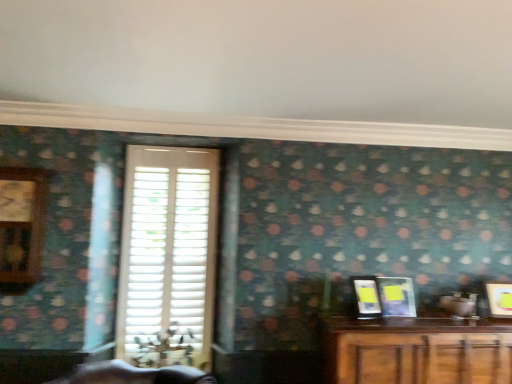
At what (x,y) coordinates should I click in order to perform the action: click on matte black picture frame at right, which is counted as the 3th picture frame, starting from the right. Please return your answer as a coordinate pair (x, y). The width and height of the screenshot is (512, 384). Looking at the image, I should click on (366, 297).

What do you see at coordinates (366, 297) in the screenshot?
I see `matte black picture frame at right, arranged as the first picture frame when viewed from the left` at bounding box center [366, 297].

Find the location of a particular element. This screenshot has width=512, height=384. wooden clock at left is located at coordinates (22, 223).

Find the location of a particular element. The height and width of the screenshot is (384, 512). matte yellow picture frame at right, which ranks as the 3th picture frame in left-to-right order is located at coordinates (499, 299).

The image size is (512, 384). What do you see at coordinates (168, 256) in the screenshot?
I see `white matte shutters at center` at bounding box center [168, 256].

You are a GUI agent. You are given a task and a screenshot of the screen. Output one action in this format:
    pyautogui.click(x=<x>, y=<y>)
    Task: Click on the matte black picture frame at right, which is counted as the 3th picture frame, starting from the right
    
    Given the screenshot: What is the action you would take?
    pyautogui.click(x=366, y=297)

From the image's perspective, relative to metallic silver picture frame at right, which is counted as the second picture frame, starting from the right, is matte black picture frame at right, which is counted as the 3th picture frame, starting from the right, above or below?

matte black picture frame at right, which is counted as the 3th picture frame, starting from the right, is above metallic silver picture frame at right, which is counted as the second picture frame, starting from the right.

Based on the photo, does matte black picture frame at right, which is counted as the 3th picture frame, starting from the right, have a greater width compared to metallic silver picture frame at right, which is counted as the second picture frame, starting from the right?

No, matte black picture frame at right, which is counted as the 3th picture frame, starting from the right, is not wider than metallic silver picture frame at right, which is counted as the second picture frame, starting from the right.

Looking at the image, does matte black picture frame at right, arranged as the first picture frame when viewed from the left, seem bigger or smaller compared to metallic silver picture frame at right, the second picture frame in the left-to-right sequence?

Considering their sizes, matte black picture frame at right, arranged as the first picture frame when viewed from the left, takes up less space than metallic silver picture frame at right, the second picture frame in the left-to-right sequence.

Considering the positions of point (376, 317) and point (392, 280), is point (376, 317) closer or farther from the camera than point (392, 280)?

Point (376, 317) appears to be closer to the viewer than point (392, 280).

Is white matte shutters at center wider than matte yellow picture frame at right, which ranks as the 3th picture frame in left-to-right order?

Incorrect, the width of white matte shutters at center does not surpass that of matte yellow picture frame at right, which ranks as the 3th picture frame in left-to-right order.

Is white matte shutters at center facing towards matte yellow picture frame at right, which ranks as the 3th picture frame in left-to-right order?

No.

Are white matte shutters at center and matte yellow picture frame at right, which ranks as the 3th picture frame in left-to-right order, far apart?

Yes, white matte shutters at center is far from matte yellow picture frame at right, which ranks as the 3th picture frame in left-to-right order.

Can we say white matte shutters at center lies outside matte yellow picture frame at right, marked as the 1th picture frame in a right-to-left arrangement?

That's correct, white matte shutters at center is outside of matte yellow picture frame at right, marked as the 1th picture frame in a right-to-left arrangement.

Could you measure the distance between matte yellow picture frame at right, marked as the 1th picture frame in a right-to-left arrangement, and matte black picture frame at right, which is counted as the 3th picture frame, starting from the right?

matte yellow picture frame at right, marked as the 1th picture frame in a right-to-left arrangement, is 27.29 inches from matte black picture frame at right, which is counted as the 3th picture frame, starting from the right.

Does matte yellow picture frame at right, which ranks as the 3th picture frame in left-to-right order, have a lesser height compared to matte black picture frame at right, arranged as the first picture frame when viewed from the left?

Correct, matte yellow picture frame at right, which ranks as the 3th picture frame in left-to-right order, is not as tall as matte black picture frame at right, arranged as the first picture frame when viewed from the left.

Based on the photo, who is more distant, matte yellow picture frame at right, marked as the 1th picture frame in a right-to-left arrangement, or matte black picture frame at right, arranged as the first picture frame when viewed from the left?

matte yellow picture frame at right, marked as the 1th picture frame in a right-to-left arrangement, is further away from the camera.

Are matte yellow picture frame at right, which ranks as the 3th picture frame in left-to-right order, and matte black picture frame at right, which is counted as the 3th picture frame, starting from the right, making contact?

No, matte yellow picture frame at right, which ranks as the 3th picture frame in left-to-right order, is not touching matte black picture frame at right, which is counted as the 3th picture frame, starting from the right.

Considering their positions, is matte black picture frame at right, which is counted as the 3th picture frame, starting from the right, located in front of or behind wooden clock at left?

Visually, matte black picture frame at right, which is counted as the 3th picture frame, starting from the right, is located behind wooden clock at left.

In the scene shown: Is matte black picture frame at right, arranged as the first picture frame when viewed from the left, with wooden clock at left?

matte black picture frame at right, arranged as the first picture frame when viewed from the left, and wooden clock at left are not in contact.

Choose the correct answer: Is matte black picture frame at right, which is counted as the 3th picture frame, starting from the right, inside wooden clock at left or outside it?

matte black picture frame at right, which is counted as the 3th picture frame, starting from the right, is not inside wooden clock at left, it's outside.

Between point (351, 278) and point (9, 198), which one is positioned in front?

Point (9, 198)

Is metallic silver picture frame at right, which is counted as the second picture frame, starting from the right, positioned with its back to wooden clock at left?

No, wooden clock at left is not at the back of metallic silver picture frame at right, which is counted as the second picture frame, starting from the right.

This screenshot has width=512, height=384. What are the coordinates of `picture frame that is the 2nd one when counting downward from the wooden clock at left (from the image's perspective)` in the screenshot? It's located at (397, 296).

Between metallic silver picture frame at right, the second picture frame in the left-to-right sequence, and wooden clock at left, which one appears on the right side from the viewer's perspective?

Positioned to the right is metallic silver picture frame at right, the second picture frame in the left-to-right sequence.

Is metallic silver picture frame at right, which is counted as the second picture frame, starting from the right, far away from wooden clock at left?

metallic silver picture frame at right, which is counted as the second picture frame, starting from the right, is far away from wooden clock at left.

Is matte yellow picture frame at right, marked as the 1th picture frame in a right-to-left arrangement, far from metallic silver picture frame at right, which is counted as the second picture frame, starting from the right?

matte yellow picture frame at right, marked as the 1th picture frame in a right-to-left arrangement, is near metallic silver picture frame at right, which is counted as the second picture frame, starting from the right, not far away.

Which object is closer to the camera, matte yellow picture frame at right, marked as the 1th picture frame in a right-to-left arrangement, or metallic silver picture frame at right, the second picture frame in the left-to-right sequence?

metallic silver picture frame at right, the second picture frame in the left-to-right sequence, is more forward.

Can we say matte yellow picture frame at right, which ranks as the 3th picture frame in left-to-right order, lies outside metallic silver picture frame at right, the second picture frame in the left-to-right sequence?

Indeed, matte yellow picture frame at right, which ranks as the 3th picture frame in left-to-right order, is completely outside metallic silver picture frame at right, the second picture frame in the left-to-right sequence.

How different are the orientations of wooden clock at left and metallic silver picture frame at right, which is counted as the second picture frame, starting from the right, in degrees?

5.83 degrees.

Considering the positions of points (12, 230) and (386, 288), is point (12, 230) closer to camera compared to point (386, 288)?

Yes.

From a real-world perspective, which object stands above the other?

In real-world perspective, wooden clock at left is above.

From the picture: Can you confirm if wooden clock at left is smaller than metallic silver picture frame at right, which is counted as the second picture frame, starting from the right?

No, wooden clock at left is not smaller than metallic silver picture frame at right, which is counted as the second picture frame, starting from the right.

From a real-world perspective, count 1st picture frames upward from the matte black picture frame at right, which is counted as the 3th picture frame, starting from the right, and point to it. Please provide its 2D coordinates.

[(397, 296)]

You are a GUI agent. You are given a task and a screenshot of the screen. Output one action in this format:
    pyautogui.click(x=<x>, y=<y>)
    Task: Click on the picture frame that is the 3rd object located below the white matte shutters at center (from the image's perspective)
    The image size is (512, 384).
    Given the screenshot: What is the action you would take?
    pyautogui.click(x=499, y=299)

Based on their spatial positions, is wooden clock at left or metallic silver picture frame at right, the second picture frame in the left-to-right sequence, further from matte black picture frame at right, arranged as the first picture frame when viewed from the left?

The object further to matte black picture frame at right, arranged as the first picture frame when viewed from the left, is wooden clock at left.

From the image, which object appears to be nearer to metallic silver picture frame at right, the second picture frame in the left-to-right sequence, wooden clock at left or white matte shutters at center?

white matte shutters at center is closer to metallic silver picture frame at right, the second picture frame in the left-to-right sequence.

Which object lies nearer to the anchor point matte black picture frame at right, arranged as the first picture frame when viewed from the left, metallic silver picture frame at right, which is counted as the second picture frame, starting from the right, or matte yellow picture frame at right, which ranks as the 3th picture frame in left-to-right order?

metallic silver picture frame at right, which is counted as the second picture frame, starting from the right, is positioned closer to the anchor matte black picture frame at right, arranged as the first picture frame when viewed from the left.

From the image, which object appears to be farther from matte black picture frame at right, which is counted as the 3th picture frame, starting from the right, matte yellow picture frame at right, which ranks as the 3th picture frame in left-to-right order, or wooden clock at left?

wooden clock at left is positioned further to the anchor matte black picture frame at right, which is counted as the 3th picture frame, starting from the right.

From the image, which object appears to be nearer to matte yellow picture frame at right, marked as the 1th picture frame in a right-to-left arrangement, white matte shutters at center or matte black picture frame at right, which is counted as the 3th picture frame, starting from the right?

The object closer to matte yellow picture frame at right, marked as the 1th picture frame in a right-to-left arrangement, is matte black picture frame at right, which is counted as the 3th picture frame, starting from the right.

Considering their positions, is white matte shutters at center positioned closer to metallic silver picture frame at right, which is counted as the second picture frame, starting from the right, than wooden clock at left?

Result: Among the two, white matte shutters at center is located nearer to metallic silver picture frame at right, which is counted as the second picture frame, starting from the right.

Based on the photo, based on their spatial positions, is wooden clock at left or matte yellow picture frame at right, which ranks as the 3th picture frame in left-to-right order, closer to matte black picture frame at right, which is counted as the 3th picture frame, starting from the right?

The object closer to matte black picture frame at right, which is counted as the 3th picture frame, starting from the right, is matte yellow picture frame at right, which ranks as the 3th picture frame in left-to-right order.

When comparing their distances from matte black picture frame at right, arranged as the first picture frame when viewed from the left, does metallic silver picture frame at right, the second picture frame in the left-to-right sequence, or wooden clock at left seem further?

wooden clock at left.

Identify the location of window between wooden clock at left and matte yellow picture frame at right, marked as the 1th picture frame in a right-to-left arrangement, from left to right. (168, 256).

The width and height of the screenshot is (512, 384). Identify the location of picture frame between matte black picture frame at right, arranged as the first picture frame when viewed from the left, and matte yellow picture frame at right, which ranks as the 3th picture frame in left-to-right order. (397, 296).

At what (x,y) coordinates should I click in order to perform the action: click on window between wooden clock at left and metallic silver picture frame at right, which is counted as the second picture frame, starting from the right. Please return your answer as a coordinate pair (x, y). Image resolution: width=512 pixels, height=384 pixels. Looking at the image, I should click on (168, 256).

I want to click on picture frame between white matte shutters at center and metallic silver picture frame at right, the second picture frame in the left-to-right sequence, from left to right, so click(366, 297).